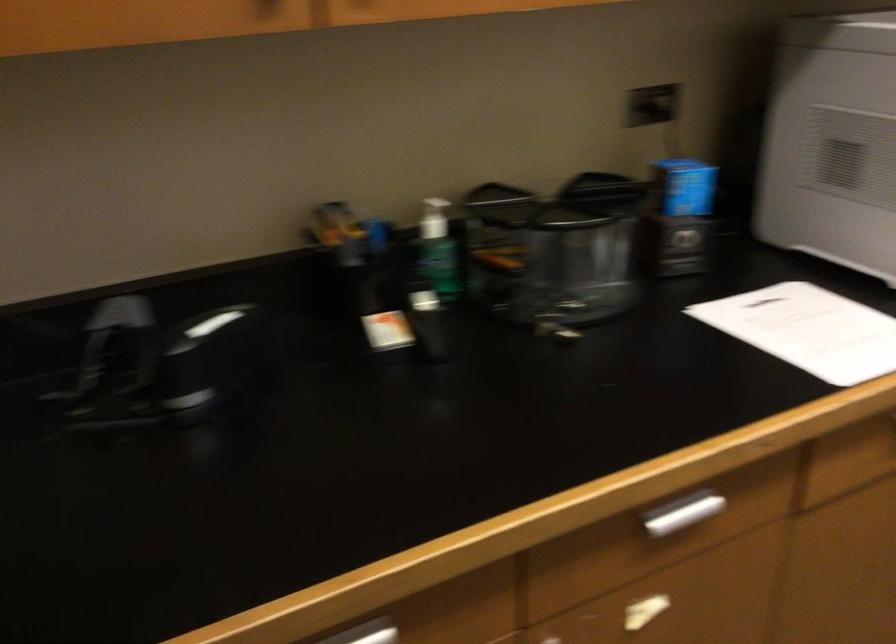
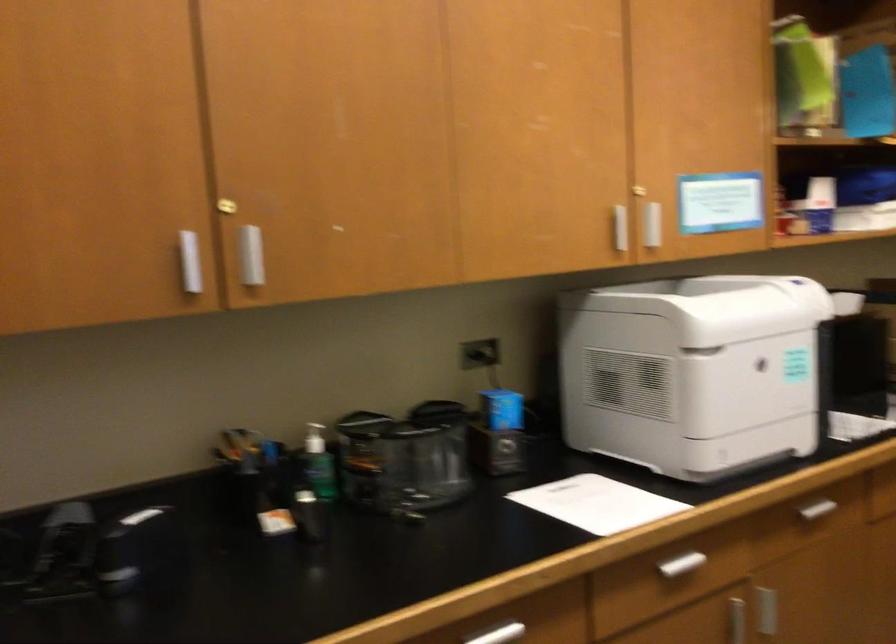
Question: The images are taken continuously from a first-person perspective. In which direction are you moving?

Choices:
 (A) Left
 (B) Right
 (C) Forward
 (D) Backward

Answer: (D)